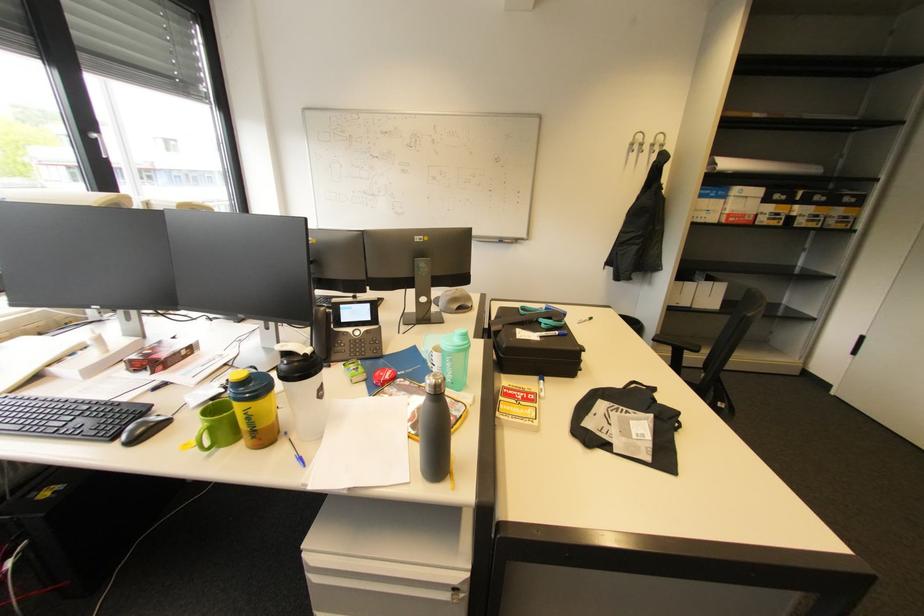
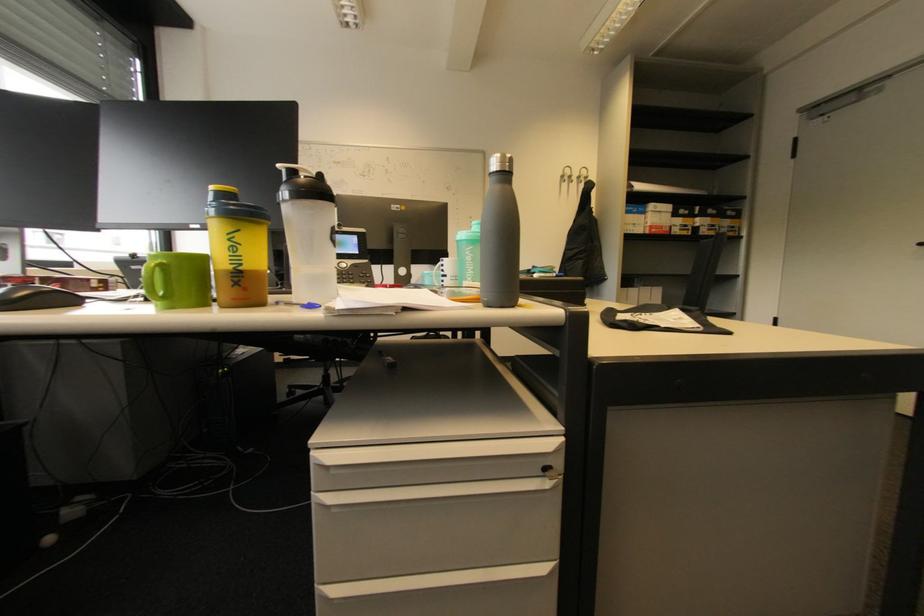
Find the pixel in the second image that matches [637,146] in the first image.

(567, 177)